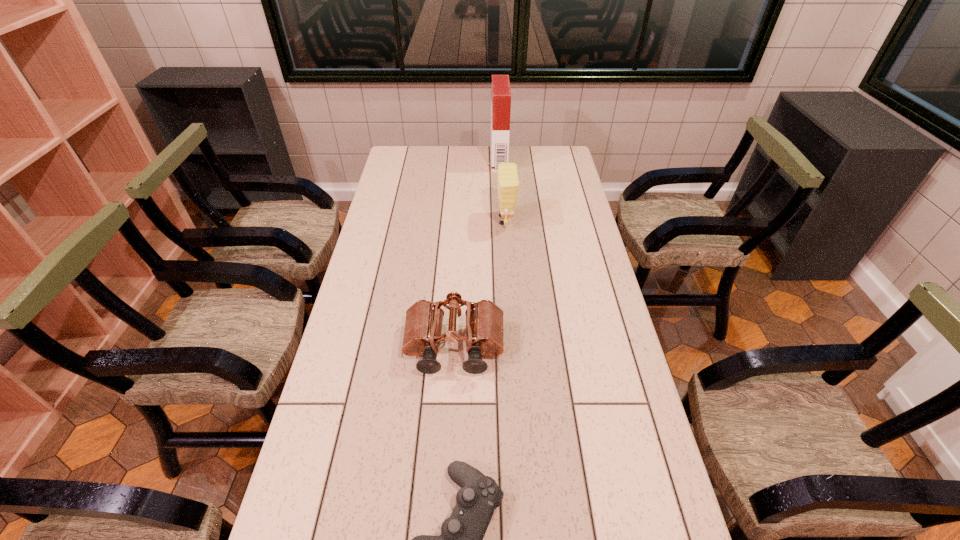
Locate an element on the screen. Image resolution: width=960 pixels, height=540 pixels. vacant point located between the tallest object and the second shortest object is located at coordinates (476, 253).

Find the location of a particular element. empty space between the farthest object and the third tallest object is located at coordinates (476, 253).

Where is `free space between the sponge and the third tallest object`? free space between the sponge and the third tallest object is located at coordinates (479, 284).

The image size is (960, 540). In order to click on free spot between the second shortest object and the third shortest object in this screenshot , I will do `click(479, 284)`.

Identify which object is located as the third nearest to the nearest object. Please provide its 2D coordinates. Your answer should be formatted as a tuple, i.e. [(x, y)], where the tuple contains the x and y coordinates of a point satisfying the conditions above.

[(501, 93)]

Identify which object is located as the nearest to the nearest object. Please provide its 2D coordinates. Your answer should be formatted as a tuple, i.e. [(x, y)], where the tuple contains the x and y coordinates of a point satisfying the conditions above.

[(484, 320)]